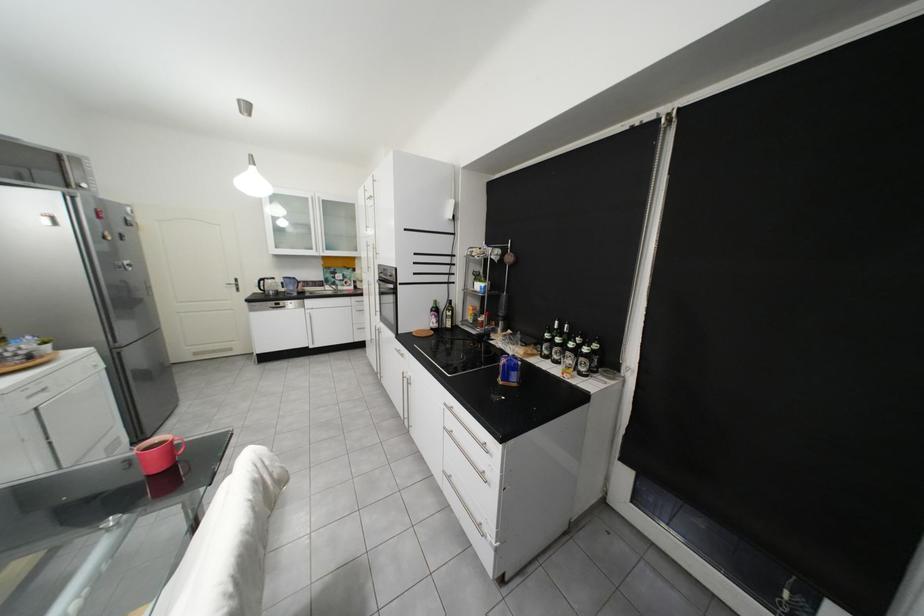
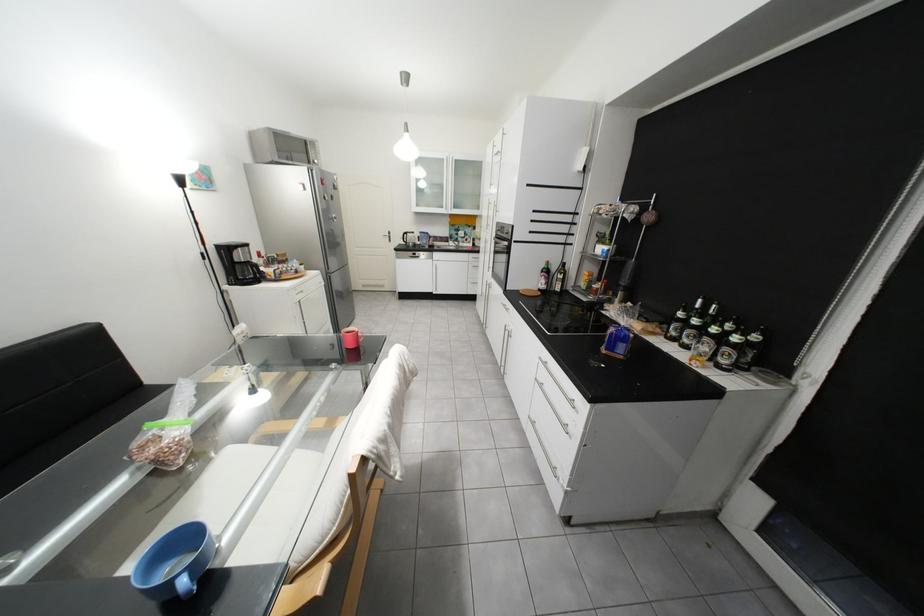
Locate, in the second image, the point that corresponds to pixel 307 294 in the first image.

(439, 248)